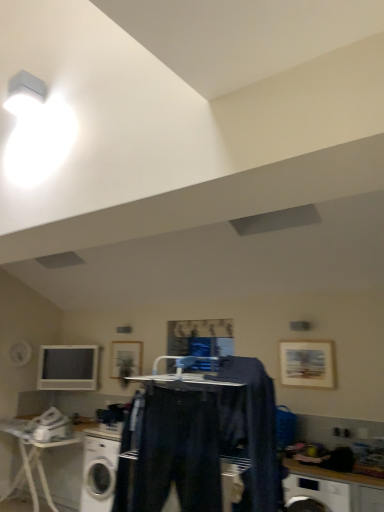
Locate an element on the screen. Image resolution: width=384 pixels, height=512 pixels. wooden countertop at lower right is located at coordinates (332, 474).

What is the approximate width of wooden framed artwork at upper right, marked as the second picture frame in a back-to-front arrangement?

It is 1.79 inches.

Describe the element at coordinates (307, 364) in the screenshot. This screenshot has height=512, width=384. I see `wooden framed artwork at upper right, arranged as the first picture frame when viewed from the right` at that location.

Measure the distance between white glossy computer monitor at left and camera.

white glossy computer monitor at left is 4.48 meters from camera.

Locate an element on the screen. wooden framed picture at center, the 1th picture frame from the back is located at coordinates (125, 358).

At what (x,y) coordinates should I click in order to perform the action: click on wooden countertop at lower right. Please return your answer as a coordinate pair (x, y). Image resolution: width=384 pixels, height=512 pixels. Looking at the image, I should click on (332, 474).

Can you confirm if white plastic table at lower left is bigger than wooden framed artwork at upper right, acting as the second picture frame starting from the left?

Correct, white plastic table at lower left is larger in size than wooden framed artwork at upper right, acting as the second picture frame starting from the left.

Does point (29, 437) appear closer or farther from the camera than point (301, 379)?

Clearly, point (29, 437) is more distant from the camera than point (301, 379).

Considering the sizes of objects white plastic table at lower left and wooden framed artwork at upper right, marked as the second picture frame in a back-to-front arrangement, in the image provided, who is wider, white plastic table at lower left or wooden framed artwork at upper right, marked as the second picture frame in a back-to-front arrangement,?

With larger width is white plastic table at lower left.

Is white plastic iron at lower left situated inside wooden framed artwork at upper right, which is the first picture frame from front to back, or outside?

white plastic iron at lower left exists outside the volume of wooden framed artwork at upper right, which is the first picture frame from front to back.

Which object is closer to the camera, white plastic iron at lower left or wooden framed artwork at upper right, arranged as the first picture frame when viewed from the right?

wooden framed artwork at upper right, arranged as the first picture frame when viewed from the right, is in front.

Between white plastic iron at lower left and wooden framed artwork at upper right, acting as the second picture frame starting from the left, which one has smaller width?

wooden framed artwork at upper right, acting as the second picture frame starting from the left, is thinner.

Does white plastic iron at lower left have a lesser height compared to wooden framed artwork at upper right, acting as the second picture frame starting from the left?

Correct, white plastic iron at lower left is not as tall as wooden framed artwork at upper right, acting as the second picture frame starting from the left.

There is a white plastic table at lower left. Find the location of `the 2nd clothing above it (from a real-world perspective)`. the 2nd clothing above it (from a real-world perspective) is located at coordinates (250, 430).

Considering the sizes of white plastic table at lower left and dark blue fabric at center, the first clothing positioned from the right, in the image, is white plastic table at lower left taller or shorter than dark blue fabric at center, the first clothing positioned from the right,?

Considering their sizes, white plastic table at lower left has more height than dark blue fabric at center, the first clothing positioned from the right.

From a real-world perspective, who is located higher, white plastic table at lower left or dark blue fabric at center, the first clothing positioned from the right?

In real-world perspective, dark blue fabric at center, the first clothing positioned from the right, is above.

Is white plastic table at lower left far away from dark blue fabric at center, the second clothing from the left?

white plastic table at lower left is far away from dark blue fabric at center, the second clothing from the left.

Is white glossy computer monitor at left not inside white plastic iron at lower left?

Indeed, white glossy computer monitor at left is completely outside white plastic iron at lower left.

Looking at their sizes, would you say white glossy computer monitor at left is wider or thinner than white plastic iron at lower left?

white glossy computer monitor at left is thinner than white plastic iron at lower left.

Is white glossy computer monitor at left with white plastic iron at lower left?

white glossy computer monitor at left is not next to white plastic iron at lower left, and they're not touching.

From the image's perspective, is white glossy computer monitor at left located beneath white plastic table at lower left?

Actually, white glossy computer monitor at left appears above white plastic table at lower left in the image.

Can you confirm if white glossy computer monitor at left is positioned to the left of white plastic table at lower left?

No.

Considering the relative sizes of white glossy computer monitor at left and white plastic table at lower left in the image provided, is white glossy computer monitor at left shorter than white plastic table at lower left?

Yes.

From the picture: Can you confirm if white glossy computer monitor at left is wider than white plastic table at lower left?

No.

Does dark blue fabric at center, the first clothing positioned from the right, have a lesser width compared to white plastic table at lower left?

Correct, the width of dark blue fabric at center, the first clothing positioned from the right, is less than that of white plastic table at lower left.

Can you confirm if dark blue fabric at center, the first clothing positioned from the right, is smaller than white plastic table at lower left?

Correct, dark blue fabric at center, the first clothing positioned from the right, occupies less space than white plastic table at lower left.

Is dark blue fabric at center, the second clothing from the left, not inside white plastic table at lower left?

dark blue fabric at center, the second clothing from the left, lies outside white plastic table at lower left's area.

From the image's perspective, which is below, dark blue fabric at center, the first clothing positioned from the right, or white plastic table at lower left?

white plastic table at lower left is shown below in the image.

Between point (137, 420) and point (121, 362), which one is positioned in front?

Positioned in front is point (137, 420).

Would you say denim pants at center, arranged as the 2th clothing when viewed from the right, is outside wooden framed picture at center, which is counted as the second picture frame, starting from the front?

Yes, denim pants at center, arranged as the 2th clothing when viewed from the right, is located beyond the bounds of wooden framed picture at center, which is counted as the second picture frame, starting from the front.

Is wooden framed picture at center, which ranks as the first picture frame in left-to-right order, at the back of denim pants at center, arranged as the 2th clothing when viewed from the right?

No, denim pants at center, arranged as the 2th clothing when viewed from the right, is not facing the opposite direction of wooden framed picture at center, which ranks as the first picture frame in left-to-right order.

Based on their sizes in the image, would you say denim pants at center, the first clothing from the left, is bigger or smaller than wooden framed picture at center, which is counted as the second picture frame, starting from the front?

Clearly, denim pants at center, the first clothing from the left, is larger in size than wooden framed picture at center, which is counted as the second picture frame, starting from the front.

I want to click on table behind the wooden framed artwork at upper right, arranged as the first picture frame when viewed from the right, so click(x=33, y=459).

Find the location of `picture frame that appears in front of the white plastic iron at lower left`. picture frame that appears in front of the white plastic iron at lower left is located at coordinates (307, 364).

When comparing their distances from white glossy washing machine at lower left, does dark blue fabric at center, the second clothing from the left, or white glossy computer monitor at left seem further?

The object further to white glossy washing machine at lower left is white glossy computer monitor at left.

When comparing their distances from wooden framed artwork at upper right, marked as the second picture frame in a back-to-front arrangement, does dark blue fabric at center, the second clothing from the left, or white plastic table at lower left seem further?

Based on the image, white plastic table at lower left appears to be further to wooden framed artwork at upper right, marked as the second picture frame in a back-to-front arrangement.

Considering their positions, is dark blue fabric at center, the first clothing positioned from the right, positioned further to wooden framed picture at center, the second picture frame viewed from the right, than wooden countertop at lower right?

dark blue fabric at center, the first clothing positioned from the right, is further to wooden framed picture at center, the second picture frame viewed from the right.

Estimate the real-world distances between objects in this image. Which object is further from wooden framed picture at center, which is counted as the second picture frame, starting from the front, wooden framed artwork at upper right, acting as the second picture frame starting from the left, or denim pants at center, arranged as the 2th clothing when viewed from the right?

denim pants at center, arranged as the 2th clothing when viewed from the right, is further to wooden framed picture at center, which is counted as the second picture frame, starting from the front.

Based on their spatial positions, is white glossy computer monitor at left or wooden framed picture at center, the 1th picture frame from the back, closer to wooden framed artwork at upper right, acting as the second picture frame starting from the left?

wooden framed picture at center, the 1th picture frame from the back, is positioned closer to the anchor wooden framed artwork at upper right, acting as the second picture frame starting from the left.

From the image, which object appears to be farther from white plastic table at lower left, wooden countertop at lower right or white glossy computer monitor at left?

Among the two, wooden countertop at lower right is located further to white plastic table at lower left.

Based on their spatial positions, is wooden countertop at lower right or white glossy computer monitor at left further from white glossy washing machine at lower left?

The object further to white glossy washing machine at lower left is white glossy computer monitor at left.

Estimate the real-world distances between objects in this image. Which object is further from wooden framed artwork at upper right, acting as the second picture frame starting from the left, wooden framed picture at center, which is counted as the second picture frame, starting from the front, or white glossy computer monitor at left?

Among the two, white glossy computer monitor at left is located further to wooden framed artwork at upper right, acting as the second picture frame starting from the left.

Locate an element on the screen. This screenshot has width=384, height=512. washing machine positioned between dark blue fabric at center, the second clothing from the left, and white glossy computer monitor at left from near to far is located at coordinates (100, 468).

At what (x,y) coordinates should I click in order to perform the action: click on counter top between dark blue fabric at center, the first clothing positioned from the right, and wooden framed picture at center, which ranks as the first picture frame in left-to-right order, from front to back. Please return your answer as a coordinate pair (x, y). This screenshot has height=512, width=384. Looking at the image, I should click on (332, 474).

Locate an element on the screen. This screenshot has height=512, width=384. appliance between white glossy computer monitor at left and wooden framed artwork at upper right, acting as the second picture frame starting from the left, from left to right is located at coordinates (50, 426).

Where is `computer monitor between white plastic table at lower left and wooden countertop at lower right from left to right`? computer monitor between white plastic table at lower left and wooden countertop at lower right from left to right is located at coordinates (68, 368).